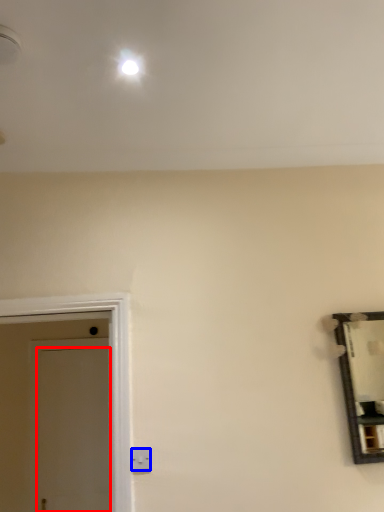
Question: Which object is further to the camera taking this photo, door (highlighted by a red box) or electric outlet (highlighted by a blue box)?

Choices:
 (A) door
 (B) electric outlet

Answer: (A)